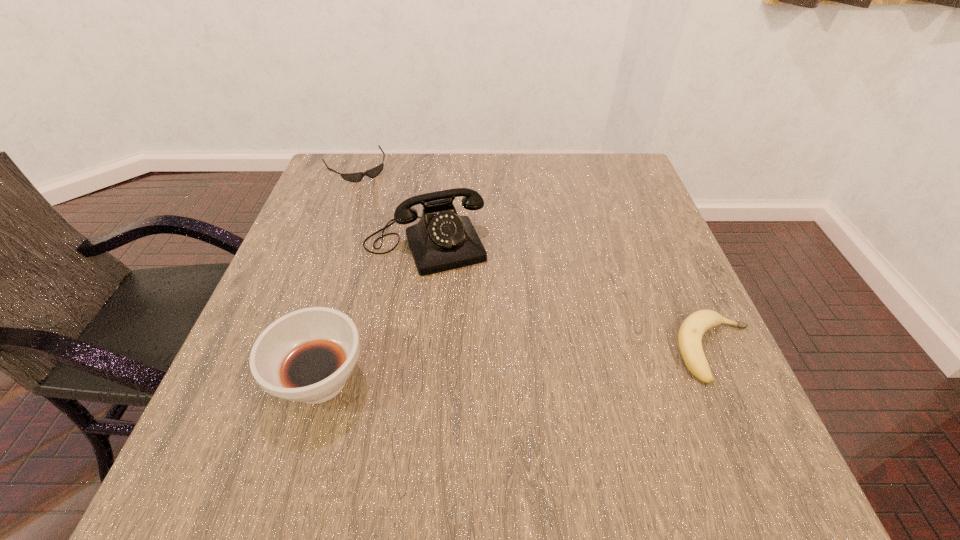
Locate an element on the screen. vacant space on the desktop that is between the third shortest object and the rightmost object and is positioned on the front-facing side of the farthest object is located at coordinates (481, 368).

Where is `vacant space on the desktop that is between the soup bowl and the rightmost object and is positioned on the front face of the tallest object`? This screenshot has width=960, height=540. vacant space on the desktop that is between the soup bowl and the rightmost object and is positioned on the front face of the tallest object is located at coordinates (470, 369).